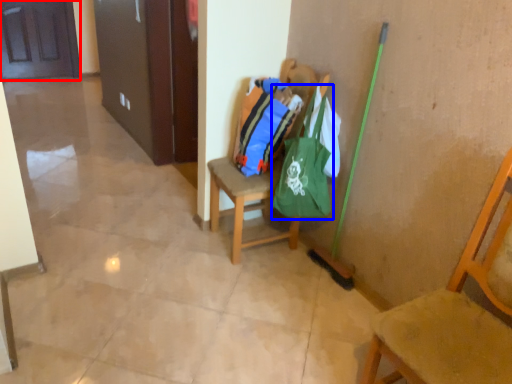
Question: Which point is closer to the camera, door (highlighted by a red box) or shoulder bag (highlighted by a blue box)?

Choices:
 (A) door
 (B) shoulder bag

Answer: (B)